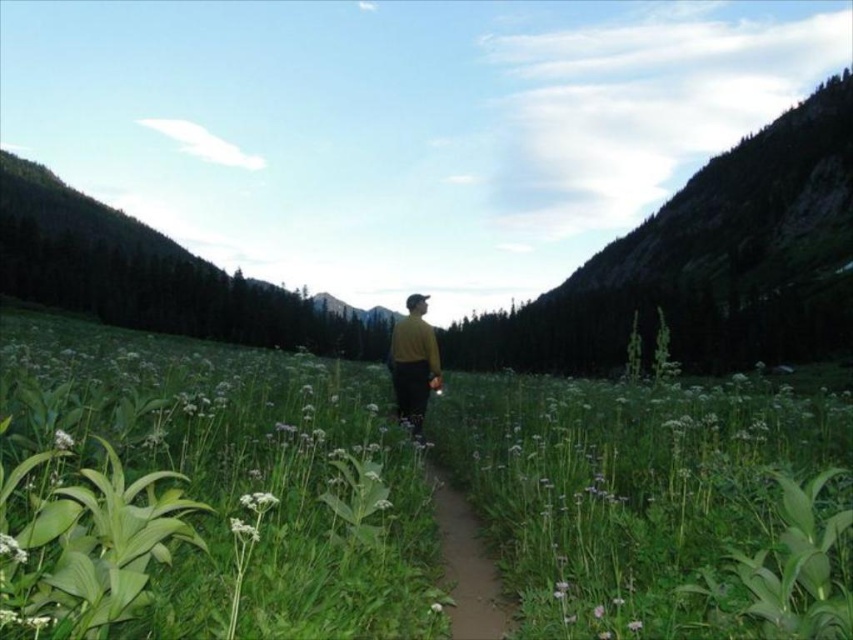
Question: Is green leafy plant at lower left to the left of white matte flower at center from the viewer's perspective?

Choices:
 (A) yes
 (B) no

Answer: (A)

Question: Which point is closer to the camera taking this photo?

Choices:
 (A) (263, 500)
 (B) (448, 483)
 (C) (631, 621)

Answer: (A)

Question: Which is nearer to the matte yellow sweater at center?

Choices:
 (A) white fluffy flower at center
 (B) white matte flower at center

Answer: (A)

Question: Based on their relative distances, which object is farther from the brown dirt path at center?

Choices:
 (A) pink matte flower at center
 (B) white fluffy flower at center

Answer: (A)

Question: Observing the image, what is the correct spatial positioning of white fluffy flower at center in reference to pink matte flower at center?

Choices:
 (A) below
 (B) above

Answer: (A)

Question: Can you confirm if white fuzzy flower at lower center is bigger than green leafy plant at lower left?

Choices:
 (A) no
 (B) yes

Answer: (A)